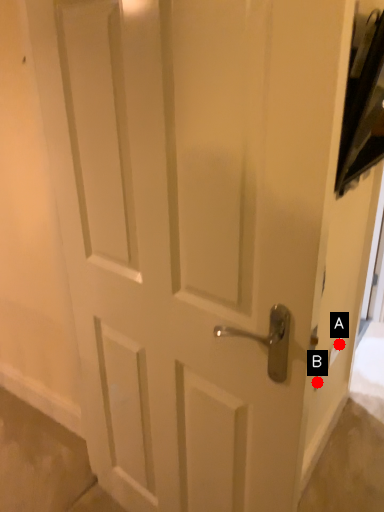
Question: Two points are circled on the image, labeled by A and B beside each circle. Which point is farther from the camera taking this photo?

Choices:
 (A) A is further
 (B) B is further

Answer: (A)